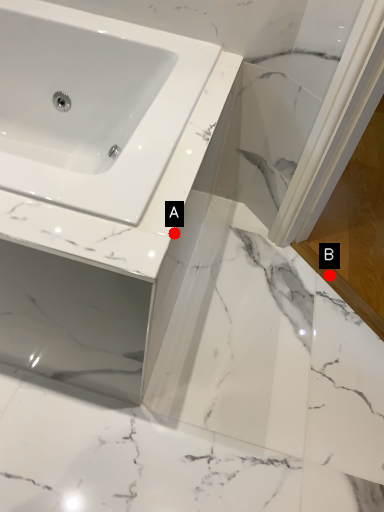
Question: Two points are circled on the image, labeled by A and B beside each circle. Among these points, which one is farthest from the camera?

Choices:
 (A) A is further
 (B) B is further

Answer: (B)